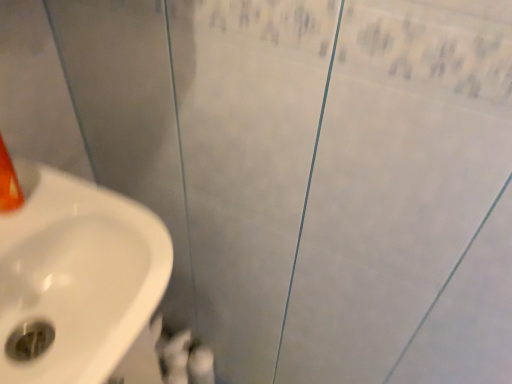
Where is `white glossy sink at lower left`? white glossy sink at lower left is located at coordinates pyautogui.click(x=78, y=275).

Image resolution: width=512 pixels, height=384 pixels. What do you see at coordinates (78, 275) in the screenshot?
I see `white glossy sink at lower left` at bounding box center [78, 275].

What is the approximate width of white glossy sink at lower left?

It is 14.23 inches.

This screenshot has width=512, height=384. I want to click on white glossy sink at lower left, so click(x=78, y=275).